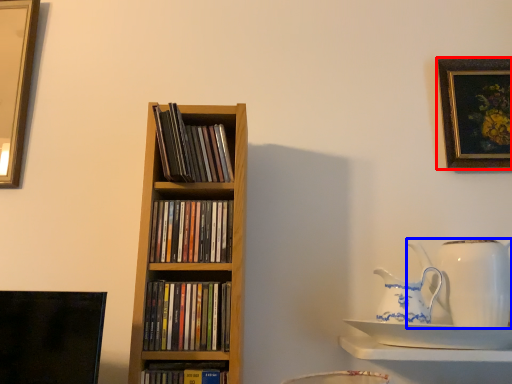
Question: Which object is further to the camera taking this photo, picture frame (highlighted by a red box) or jug (highlighted by a blue box)?

Choices:
 (A) picture frame
 (B) jug

Answer: (A)